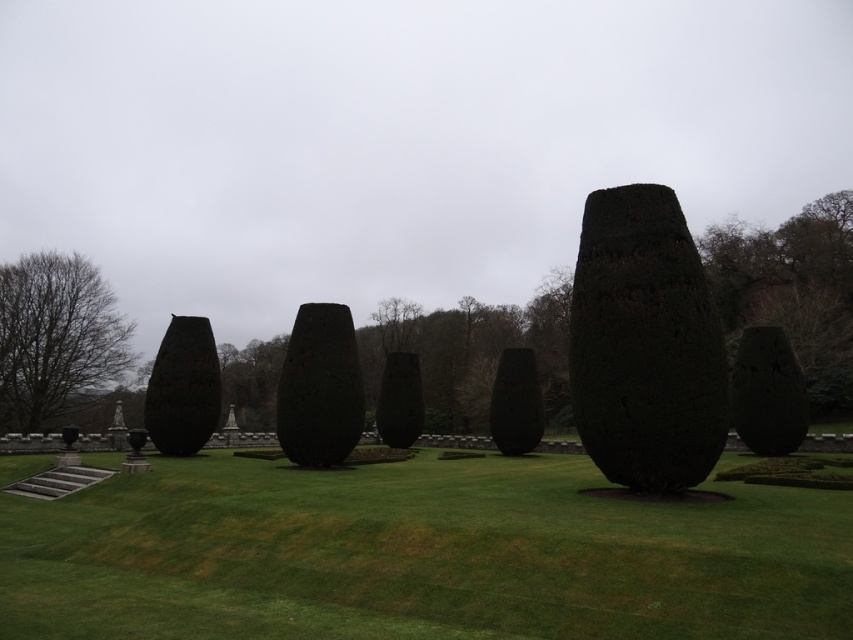
Can you confirm if dark green textured cone at center is smaller than dark brown textured vase at left?

Yes, dark green textured cone at center is smaller than dark brown textured vase at left.

Between dark green textured cone at center and dark brown textured vase at left, which one appears on the left side from the viewer's perspective?

dark brown textured vase at left

Between point (656, 417) and point (202, 403), which one is positioned behind?

Positioned behind is point (202, 403).

Find the location of a particular element. The width and height of the screenshot is (853, 640). dark green textured cone at center is located at coordinates (643, 344).

Is point (677, 428) farther from viewer compared to point (314, 404)?

No, it is in front of (314, 404).

Is point (642, 276) in front of point (305, 456)?

Yes.

This screenshot has width=853, height=640. I want to click on dark green textured cone at center, so click(643, 344).

Between dark brown bark tree at left and dark brown textured vase at left, which one has less height?

dark brown textured vase at left

Is dark brown bark tree at left above dark brown textured vase at left?

Indeed, dark brown bark tree at left is positioned over dark brown textured vase at left.

Locate an element on the screen. dark brown bark tree at left is located at coordinates (56, 337).